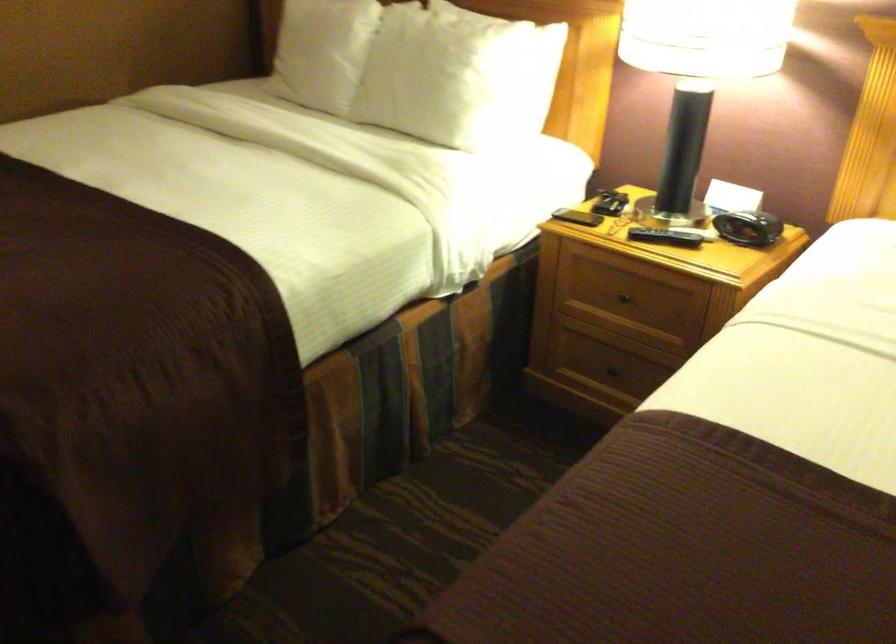
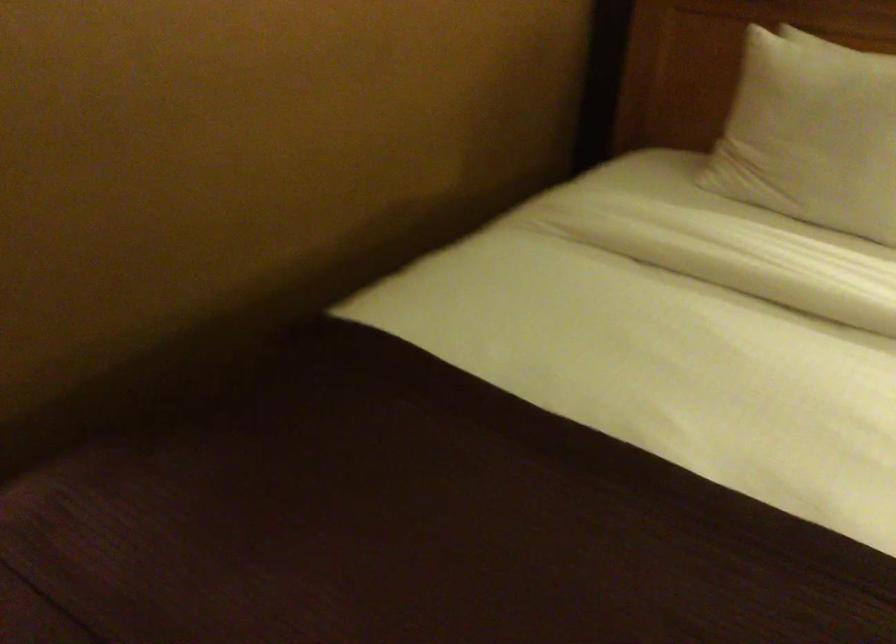
The images are taken continuously from a first-person perspective. In which direction are you moving?

The cameraman walked toward left, forward.